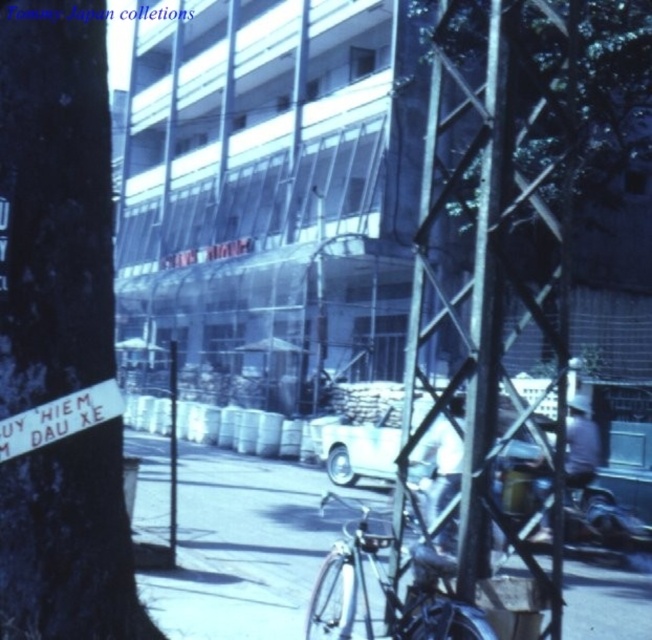
Question: Is green bark tree at left to the right of smooth asphalt pavement at center from the viewer's perspective?

Choices:
 (A) no
 (B) yes

Answer: (A)

Question: Considering the relative positions of green bark tree at left and white matte car at center in the image provided, where is green bark tree at left located with respect to white matte car at center?

Choices:
 (A) above
 (B) below

Answer: (A)

Question: Can you confirm if green bark tree at left is positioned below white matte car at center?

Choices:
 (A) no
 (B) yes

Answer: (A)

Question: Which of these objects is positioned farthest from the smooth asphalt pavement at center?

Choices:
 (A) green bark tree at left
 (B) white matte car at center

Answer: (A)

Question: Which point is farther to the camera?

Choices:
 (A) green bark tree at left
 (B) white matte car at center

Answer: (B)

Question: Which object appears farthest from the camera in this image?

Choices:
 (A) smooth asphalt pavement at center
 (B) green bark tree at left

Answer: (A)